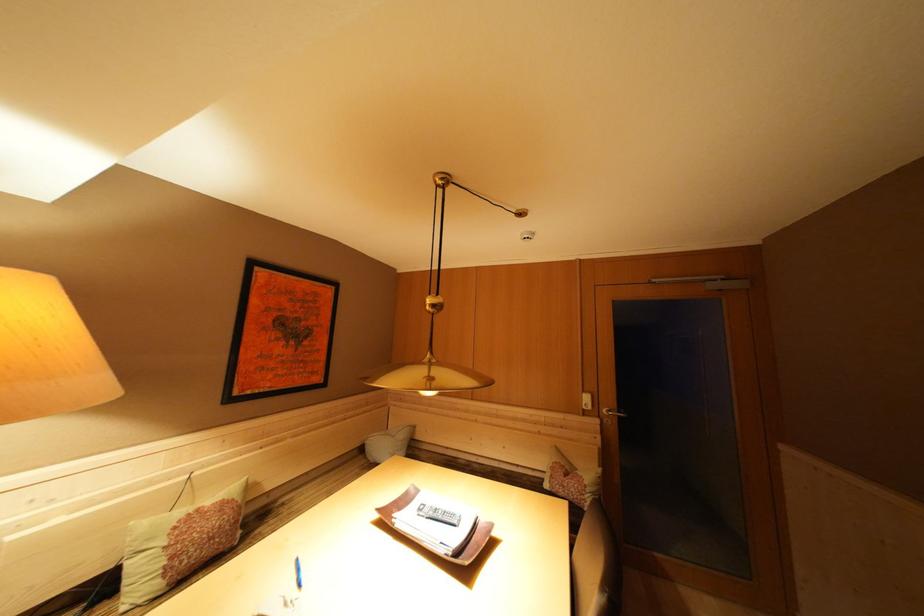
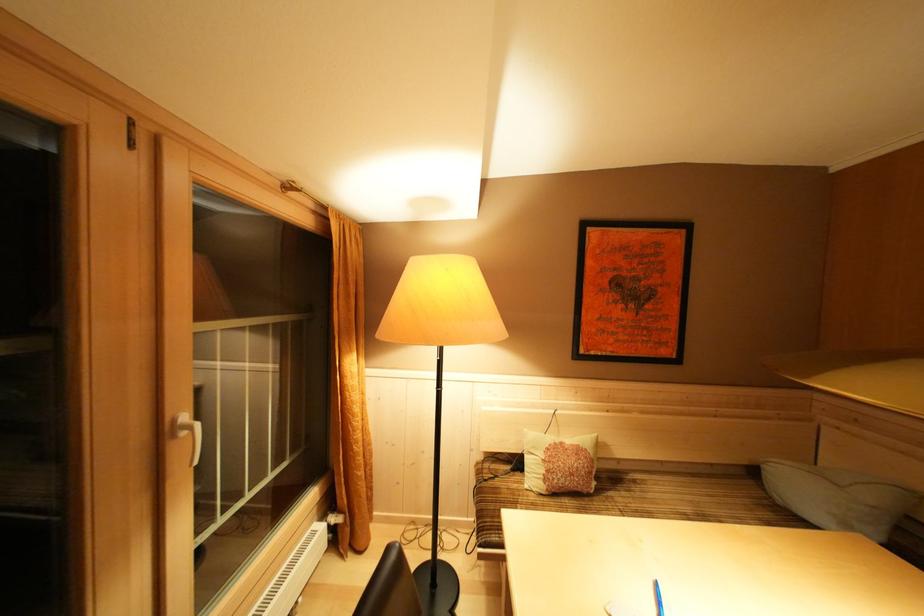
Locate, in the second image, the point that corresponds to the point at 408,440 in the first image.

(879, 503)